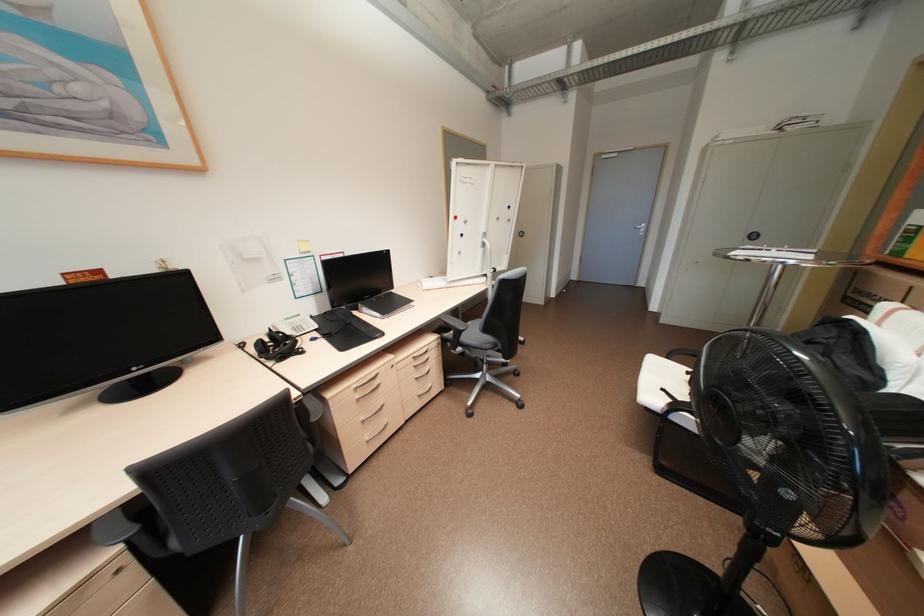
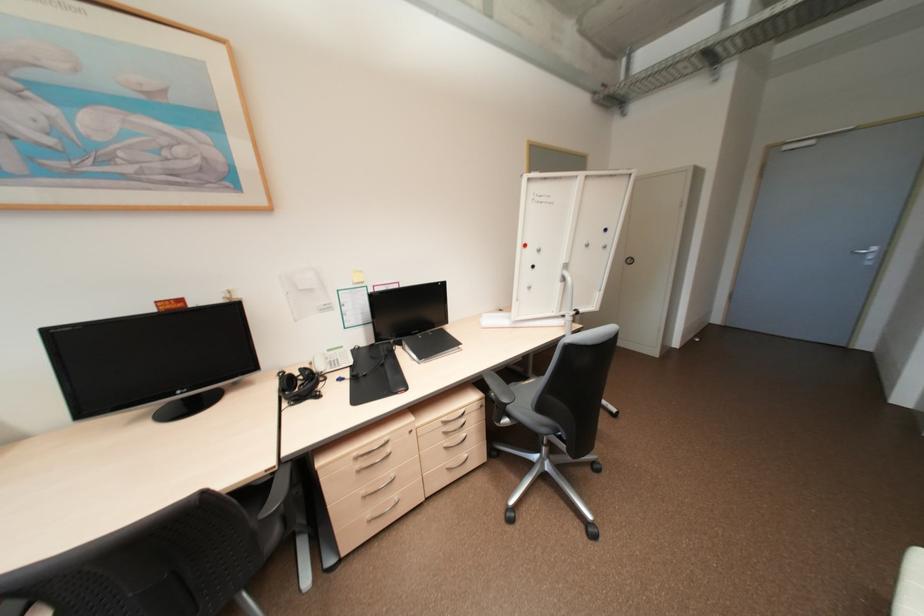
Question: The first image is from the beginning of the video and the second image is from the end. How did the camera likely rotate when shooting the video?

Choices:
 (A) Left
 (B) Right
 (C) Up
 (D) Down

Answer: (A)